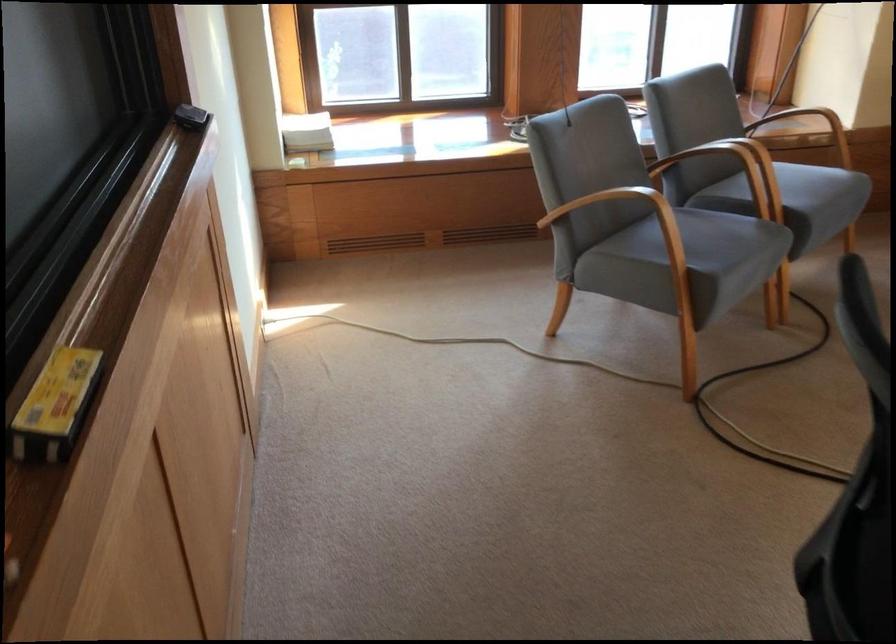
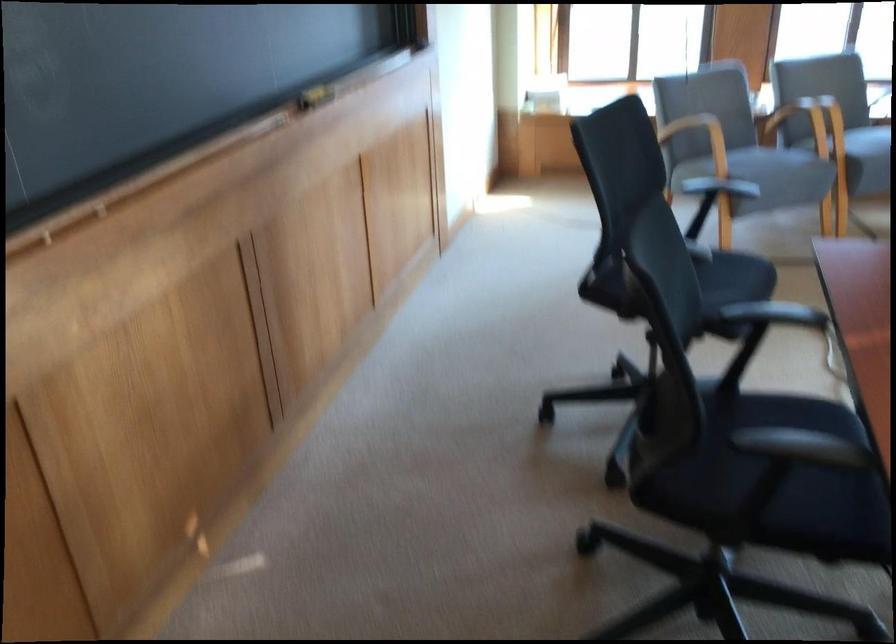
Locate, in the second image, the point that corresponds to pixel 741 279 in the first image.

(769, 172)